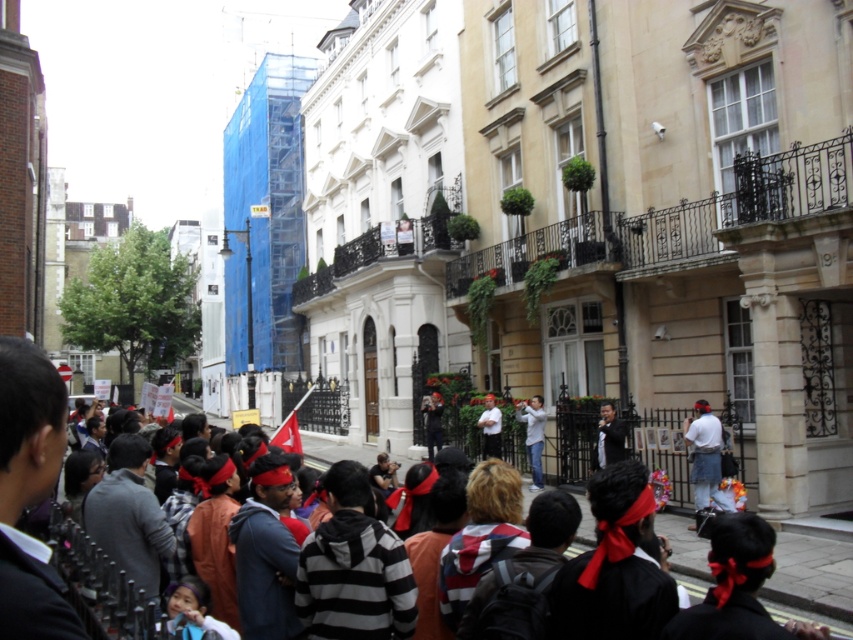
Question: Estimate the real-world distances between objects in this image. Which object is farther from the black leather jacket at center?

Choices:
 (A) white shirt at center
 (B) red bandana at center

Answer: (B)

Question: Estimate the real-world distances between objects in this image. Which object is closer to the matte black camera at center?

Choices:
 (A) white matte shirt at center
 (B) white cotton shirt at center
 (C) black leather jacket at center

Answer: (A)

Question: Does red bandana at center appear on the left side of black leather jacket at center?

Choices:
 (A) yes
 (B) no

Answer: (A)

Question: Is the position of white matte shirt at center less distant than that of white shirt at center?

Choices:
 (A) yes
 (B) no

Answer: (A)

Question: Is red bandana at center wider than matte black camera at center?

Choices:
 (A) yes
 (B) no

Answer: (A)

Question: Which object is farther from the camera taking this photo?

Choices:
 (A) white matte shirt at center
 (B) matte black camera at center

Answer: (B)